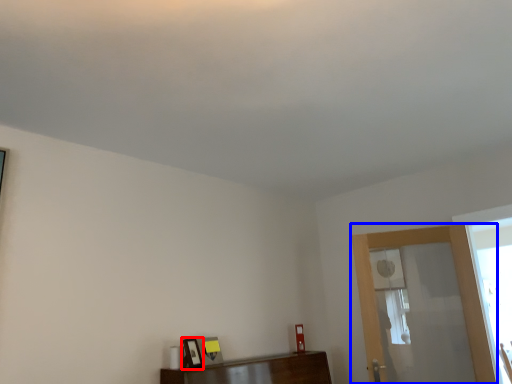
Question: Which object is closer to the camera taking this photo, picture frame (highlighted by a red box) or screen door (highlighted by a blue box)?

Choices:
 (A) picture frame
 (B) screen door

Answer: (A)